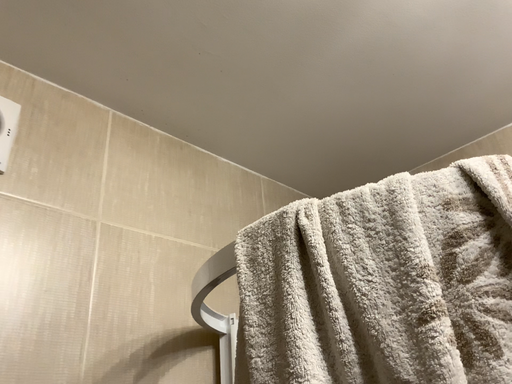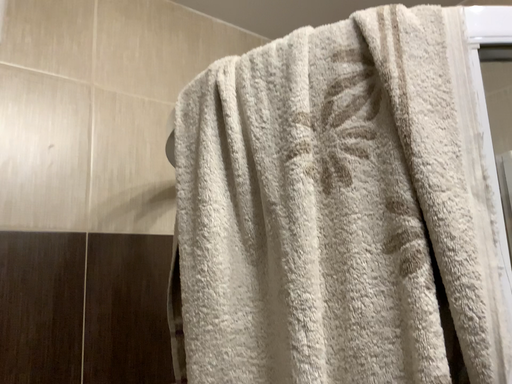
Question: How did the camera likely rotate when shooting the video?

Choices:
 (A) rotated upward
 (B) rotated downward

Answer: (B)